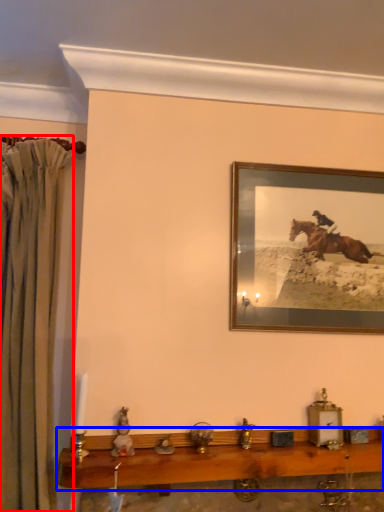
Question: Which object is closer to the camera taking this photo, curtain (highlighted by a red box) or table (highlighted by a blue box)?

Choices:
 (A) curtain
 (B) table

Answer: (B)